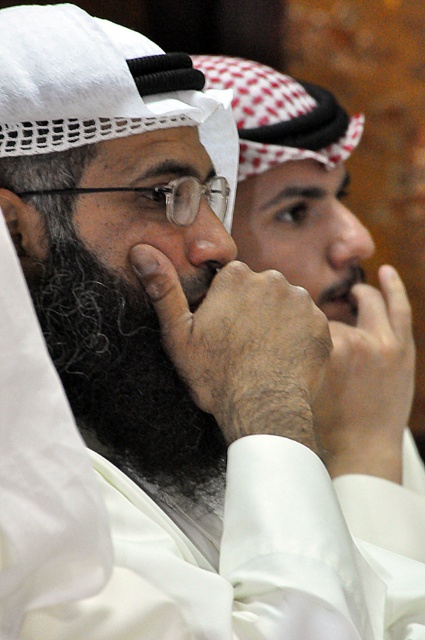
Based on the description, can you determine the exact location of the curly dark brown beard at center in the image?

The curly dark brown beard at center is located at point coordinates of 0.580 on the x axis and 0.285 on the y axis.

You are a photographer trying to capture a closeup of the curly dark brown beard at center and the smooth skin nose at center in the image. Which one would appear larger in your photo if you focus on the beard?

The curly dark brown beard at center would appear larger in the photo because it is closer to the viewer than the smooth skin nose at center.